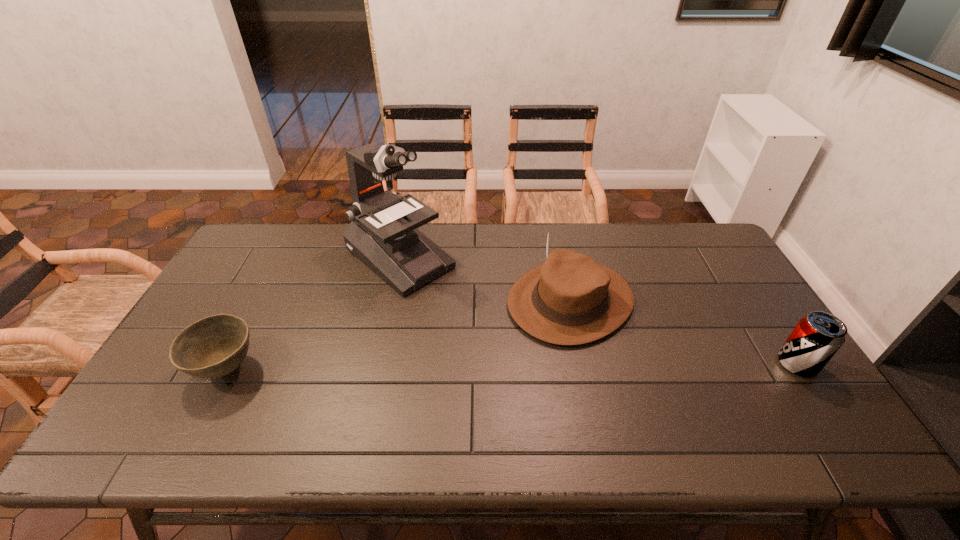
At what (x,y) coordinates should I click in order to perform the action: click on vacant space located on the feather side of the fedora. Please return your answer as a coordinate pair (x, y). This screenshot has width=960, height=540. Looking at the image, I should click on (434, 384).

The height and width of the screenshot is (540, 960). Identify the location of free location located 0.210m on the feather side of the fedora. (463, 366).

Where is `free space located on the feather side of the fedora`? free space located on the feather side of the fedora is located at coordinates (501, 342).

Locate an element on the screen. vacant point located through the eyepieces of the microscope is located at coordinates (476, 319).

Where is `vacant space located 0.050m through the eyepieces of the microscope`? vacant space located 0.050m through the eyepieces of the microscope is located at coordinates (445, 294).

You are a GUI agent. You are given a task and a screenshot of the screen. Output one action in this format:
    pyautogui.click(x=<x>, y=<y>)
    Task: Click on the blank space located through the eyepieces of the microscope
    This screenshot has width=960, height=540.
    Given the screenshot: What is the action you would take?
    pyautogui.click(x=447, y=296)

Locate an element on the screen. fedora that is at the far edge is located at coordinates (571, 299).

At what (x,y) coordinates should I click in order to perform the action: click on microscope positioned at the far edge. Please return your answer as a coordinate pair (x, y). This screenshot has height=540, width=960. Looking at the image, I should click on (383, 234).

The image size is (960, 540). In order to click on object located at the near edge in this screenshot , I will do `click(214, 346)`.

Identify the location of object situated at the left edge. (214, 346).